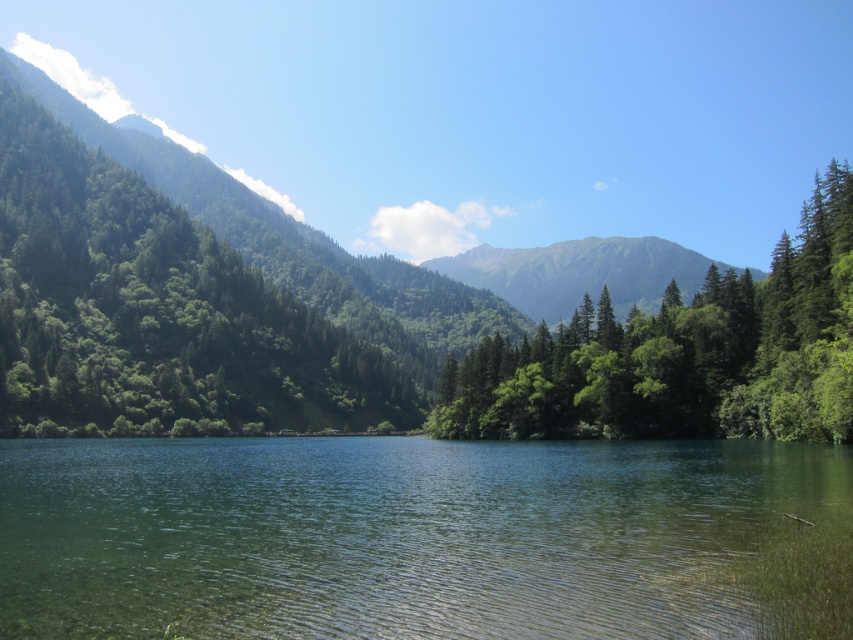
Can you confirm if green leafy trees at left is shorter than green grassy mountain at center?

Incorrect, green leafy trees at left's height does not fall short of green grassy mountain at center's.

Who is taller, green leafy trees at left or green grassy mountain at center?

Standing taller between the two is green leafy trees at left.

Image resolution: width=853 pixels, height=640 pixels. What are the coordinates of `green leafy trees at left` in the screenshot? It's located at (154, 307).

Where is `green leafy trees at left`? This screenshot has height=640, width=853. green leafy trees at left is located at coordinates (154, 307).

Consider the image. Who is taller, green matte tree at center or green grassy mountain at center?

green grassy mountain at center

Who is more distant from viewer, (758, 422) or (514, 304)?

Positioned behind is point (514, 304).

Find the location of `green matte tree at center`. green matte tree at center is located at coordinates (683, 355).

Consider the image. Which is below, clear water at center or green matte tree at center?

Positioned lower is clear water at center.

Between clear water at center and green matte tree at center, which one appears on the left side from the viewer's perspective?

clear water at center

Is point (229, 628) closer to viewer compared to point (524, 413)?

Yes, point (229, 628) is in front of point (524, 413).

Locate an element on the screen. clear water at center is located at coordinates (393, 534).